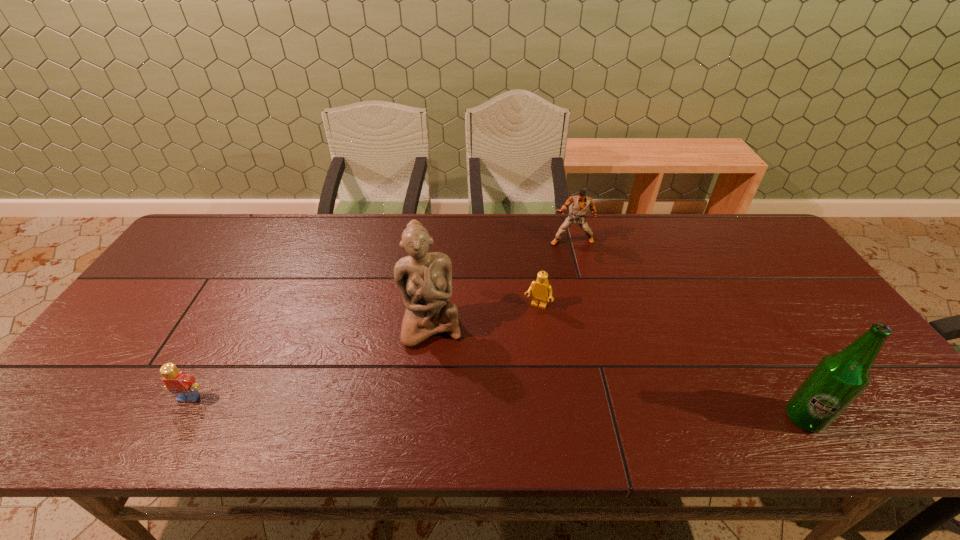
The height and width of the screenshot is (540, 960). I want to click on free spot on the desktop that is between the nearer Lego and the beer bottle and is positioned on the face of the farther Lego, so click(495, 408).

Locate an element on the screen. vacant space on the desktop that is between the left Lego and the beer bottle and is positioned on the front-facing side of the farthest object is located at coordinates (582, 411).

This screenshot has width=960, height=540. Find the location of `free space on the desktop that is between the left Lego and the rightmost object and is positioned on the front-facing side of the figurine`. free space on the desktop that is between the left Lego and the rightmost object and is positioned on the front-facing side of the figurine is located at coordinates (445, 406).